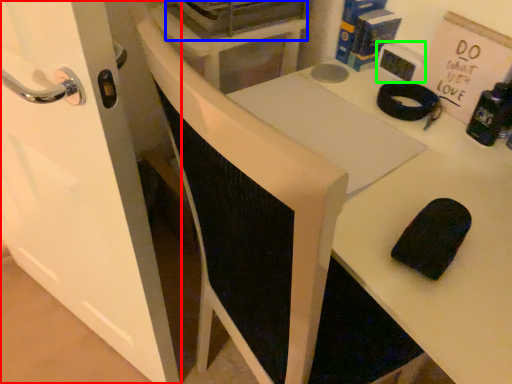
Question: Based on their relative distances, which object is nearer to door (highlighted by a red box)? Choose from appliance (highlighted by a blue box) and appliance (highlighted by a green box).

Choices:
 (A) appliance
 (B) appliance

Answer: (A)